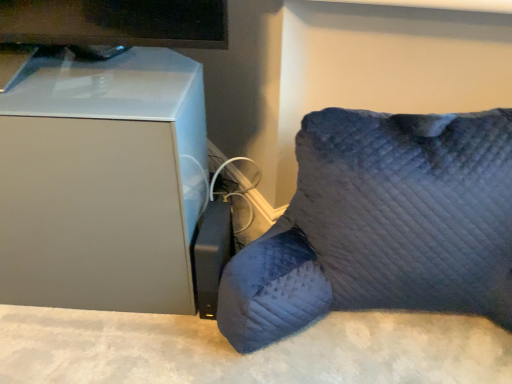
You are a GUI agent. You are given a task and a screenshot of the screen. Output one action in this format:
    pyautogui.click(x=<x>, y=<y>)
    Task: Click on the vacant location below dark blue quilted pillow at lower right, arranged as the 2th furniture when viewed from the left (from a real-world perspective)
    
    Given the screenshot: What is the action you would take?
    pyautogui.click(x=415, y=337)